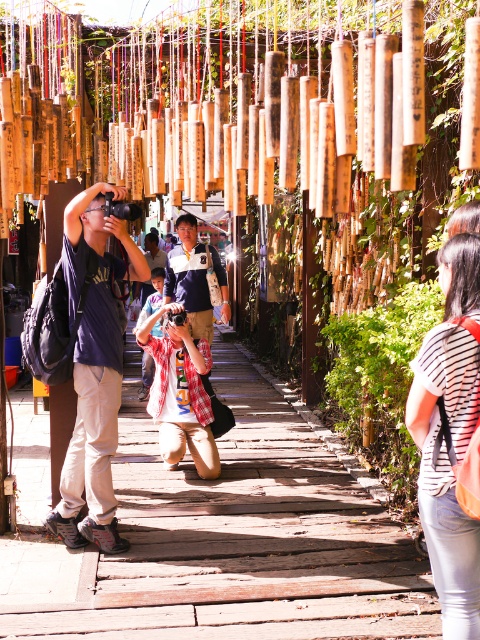
Does wooden walkway at center have a greater width compared to striped cotton shirt at right?

Yes, wooden walkway at center is wider than striped cotton shirt at right.

Does point (286, 492) come farther from viewer compared to point (453, 394)?

Yes, point (286, 492) is behind point (453, 394).

Identify the location of wooden walkway at center. This screenshot has width=480, height=640. (216, 538).

Does wooden walkway at center have a greater height compared to matte blue shirt at center?

Incorrect, wooden walkway at center's height is not larger of matte blue shirt at center's.

Does wooden walkway at center come in front of matte blue shirt at center?

Yes.

The height and width of the screenshot is (640, 480). What do you see at coordinates (216, 538) in the screenshot? I see `wooden walkway at center` at bounding box center [216, 538].

At what (x,y) coordinates should I click in order to perform the action: click on wooden walkway at center. Please return your answer as a coordinate pair (x, y). This screenshot has height=640, width=480. Looking at the image, I should click on (216, 538).

Describe the element at coordinates (450, 435) in the screenshot. I see `striped cotton shirt at right` at that location.

Can you confirm if striped cotton shirt at right is taller than matte blue shirt at center?

Incorrect, striped cotton shirt at right's height is not larger of matte blue shirt at center's.

Locate an element on the screen. Image resolution: width=480 pixels, height=640 pixels. striped cotton shirt at right is located at coordinates (450, 435).

I want to click on striped cotton shirt at right, so click(x=450, y=435).